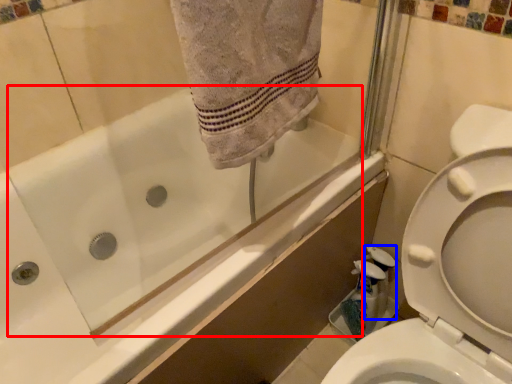
Question: Among these objects, which one is nearest to the camera, bath (highlighted by a red box) or cleaning product (highlighted by a blue box)?

Choices:
 (A) bath
 (B) cleaning product

Answer: (A)